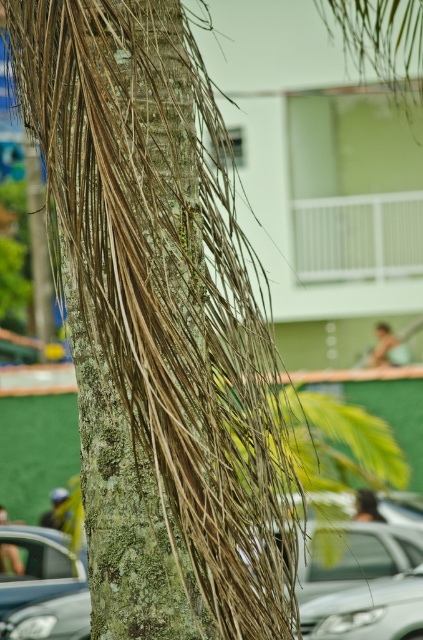
Question: Is lichen-covered bark at center wider than metallic silver car at lower left?

Choices:
 (A) no
 (B) yes

Answer: (A)

Question: Which point is closer to the camera?

Choices:
 (A) metallic silver car at lower left
 (B) lichen-covered bark at center

Answer: (B)

Question: Is lichen-covered bark at center wider than sleek silver sedan at lower center?

Choices:
 (A) yes
 (B) no

Answer: (B)

Question: Which point is closer to the camera?

Choices:
 (A) (382, 637)
 (B) (58, 573)

Answer: (A)

Question: Estimate the real-world distances between objects in this image. Which object is farther from the lichen-covered bark at center?

Choices:
 (A) metallic silver car at lower left
 (B) sleek silver sedan at lower center

Answer: (A)

Question: Is metallic silver car at lower left bigger than sleek silver sedan at lower center?

Choices:
 (A) yes
 (B) no

Answer: (A)